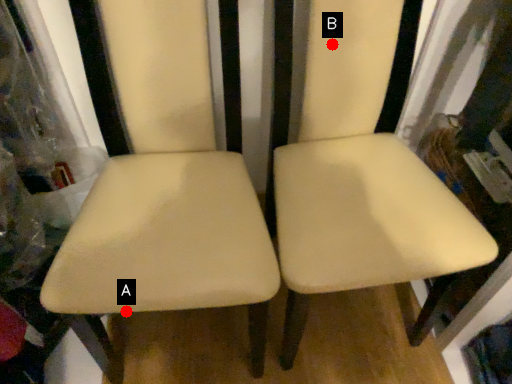
Question: Two points are circled on the image, labeled by A and B beside each circle. Among these points, which one is nearest to the camera?

Choices:
 (A) A is closer
 (B) B is closer

Answer: (A)